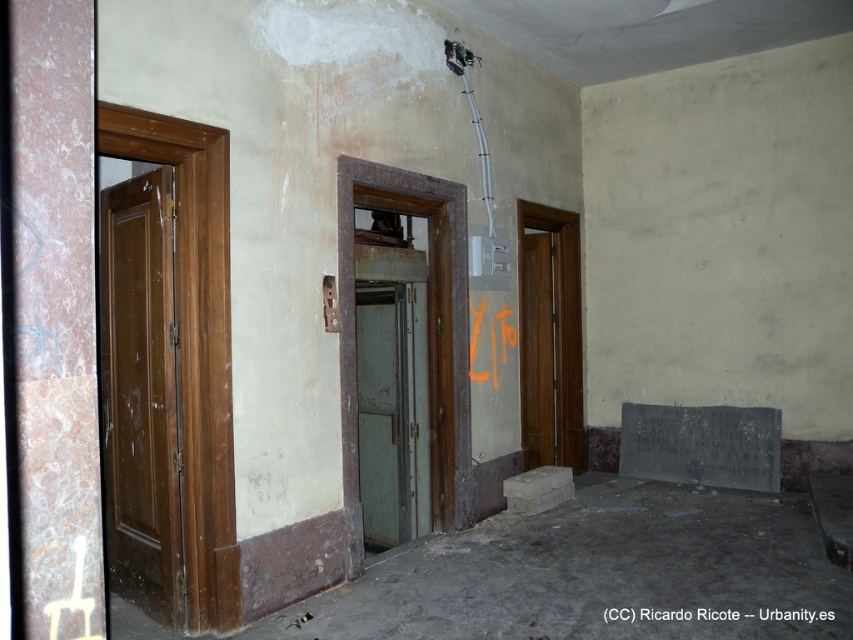
Does brown wooden door at center right have a lesser width compared to green matte door at center?

Incorrect, brown wooden door at center right's width is not less than green matte door at center's.

I want to click on brown wooden door at center right, so click(550, 337).

Can you confirm if matte brown door at left is wider than brown wooden door at center right?

Incorrect, matte brown door at left's width does not surpass brown wooden door at center right's.

Does matte brown door at left appear under brown wooden door at center right?

Correct, matte brown door at left is located below brown wooden door at center right.

Is point (155, 612) less distant than point (567, 404)?

Yes, it is in front of point (567, 404).

Find the location of a particular element. The image size is (853, 640). matte brown door at left is located at coordinates (140, 394).

Which is more to the left, matte brown door at left or green matte door at center?

From the viewer's perspective, matte brown door at left appears more on the left side.

Is matte brown door at left positioned before green matte door at center?

Yes, it is.

The width and height of the screenshot is (853, 640). In order to click on matte brown door at left in this screenshot , I will do `click(140, 394)`.